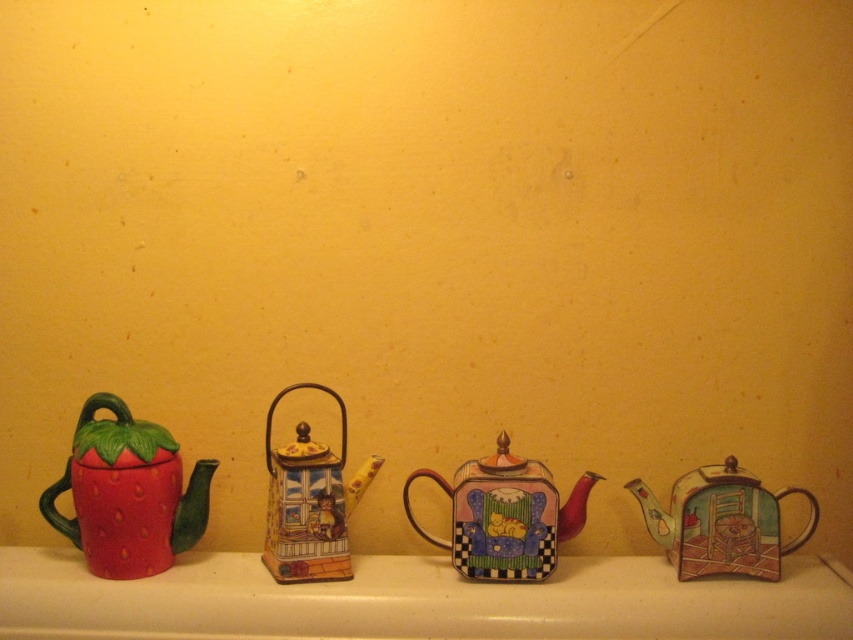
Question: Does multicolored ceramic teapot at center come behind matte ceramic teapot at center?

Choices:
 (A) yes
 (B) no

Answer: (A)

Question: Is matte ceramic strawberry-shaped teapot at left thinner than multicolored ceramic teapot at center?

Choices:
 (A) no
 (B) yes

Answer: (B)

Question: Which of the following is the closest to the observer?

Choices:
 (A) (366, 484)
 (B) (117, 428)

Answer: (B)

Question: Considering the relative positions of white glossy window sill at center and metallic silver teapot at right in the image provided, where is white glossy window sill at center located with respect to metallic silver teapot at right?

Choices:
 (A) above
 (B) below

Answer: (B)

Question: Considering the real-world distances, which object is closest to the multicolored ceramic teapot at center?

Choices:
 (A) metallic silver teapot at right
 (B) matte ceramic strawberry-shaped teapot at left
 (C) matte ceramic teapot at center
 (D) white glossy window sill at center

Answer: (D)

Question: Which point appears closest to the camera in this image?

Choices:
 (A) (721, 556)
 (B) (532, 524)

Answer: (A)